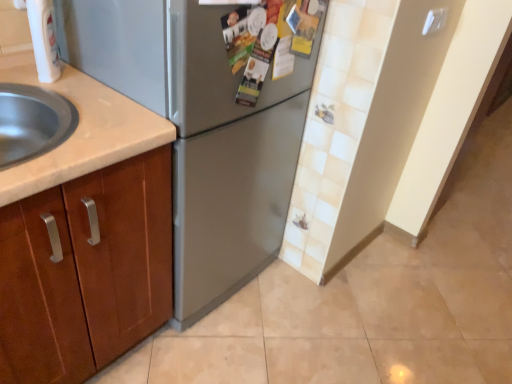
Find the location of `empty space that is to the right of satin silver refrigerator at center`. empty space that is to the right of satin silver refrigerator at center is located at coordinates (322, 311).